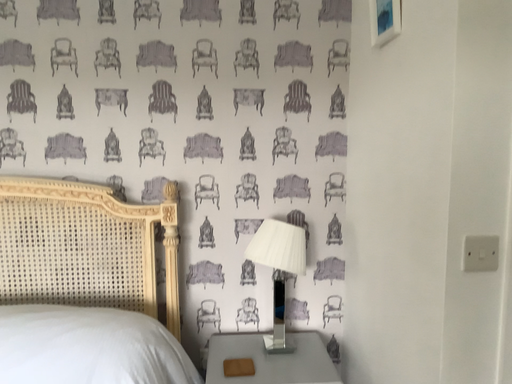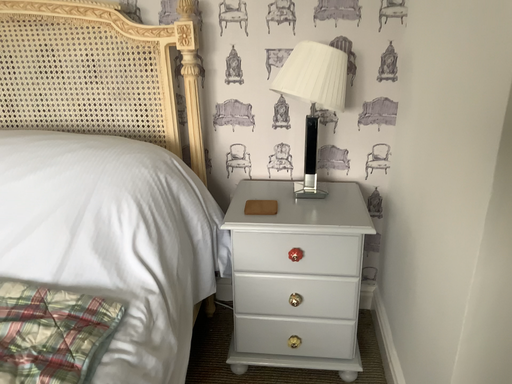
Question: How did the camera likely rotate when shooting the video?

Choices:
 (A) rotated downward
 (B) rotated upward

Answer: (A)